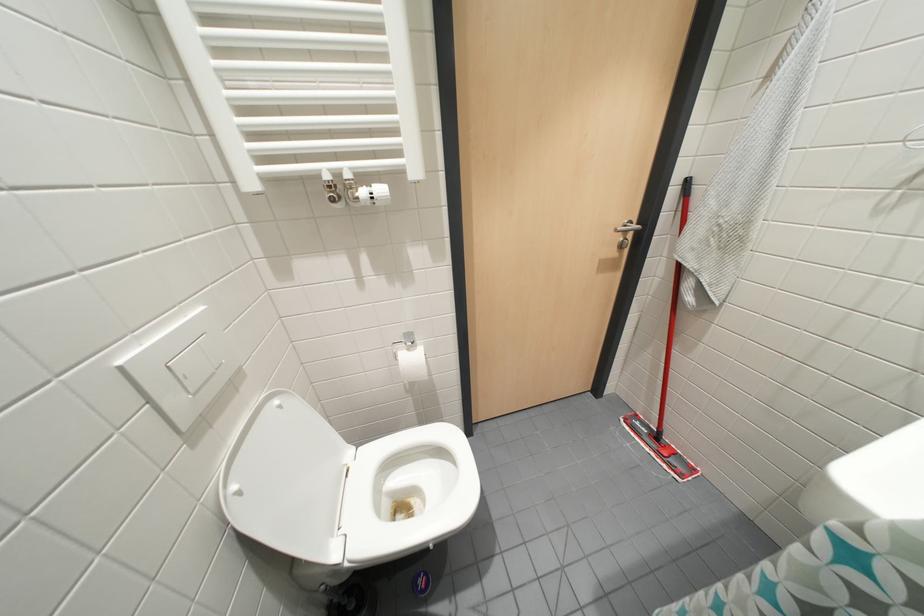
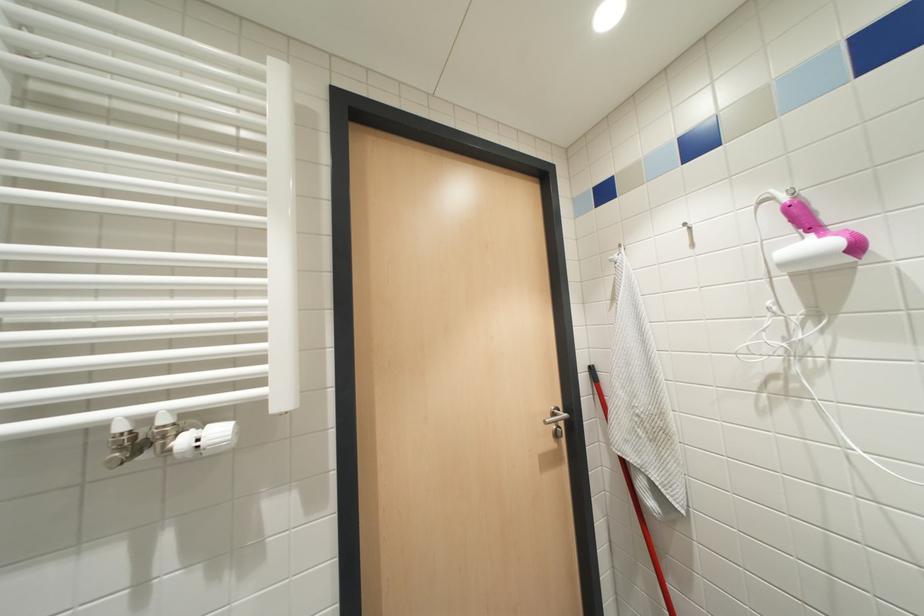
Question: The images are taken continuously from a first-person perspective. In which direction is your viewpoint rotating?

Choices:
 (A) Left
 (B) Right
 (C) Up
 (D) Down

Answer: (C)